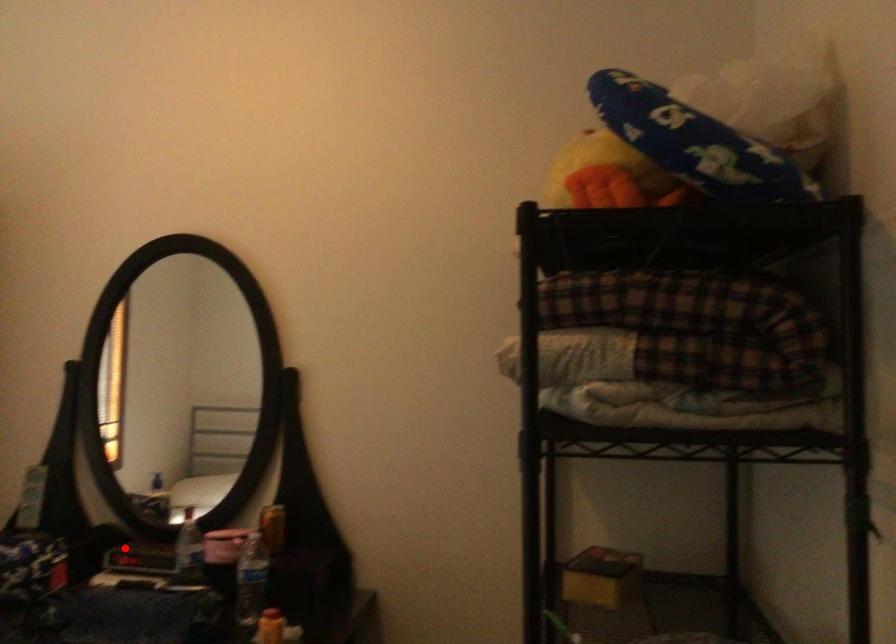
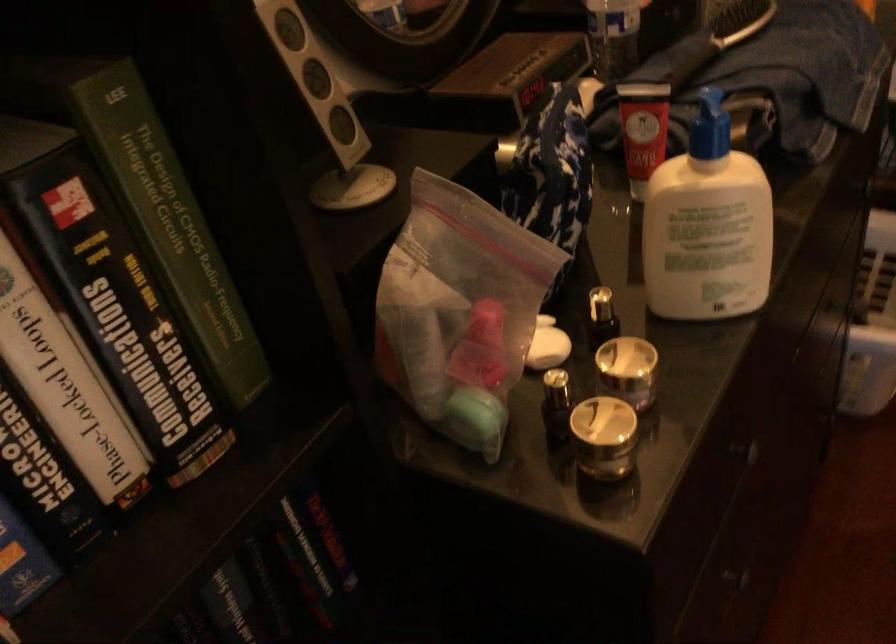
Question: I am providing you with two images of the same scene from different viewpoints. A red point is marked on the first image. Is the red point's position out of view in image 2?

Choices:
 (A) Yes
 (B) No

Answer: (B)